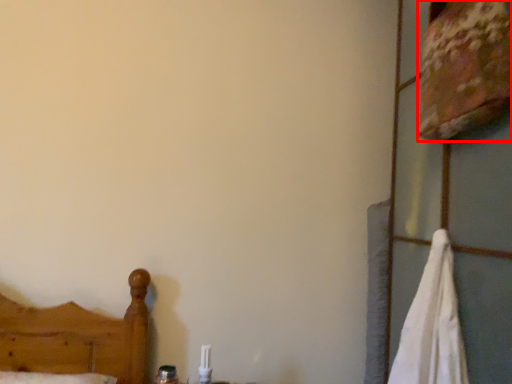
Question: From the image's perspective, what is the correct spatial positioning of sheet (annotated by the red box) in reference to bath towel?

Choices:
 (A) below
 (B) above

Answer: (B)